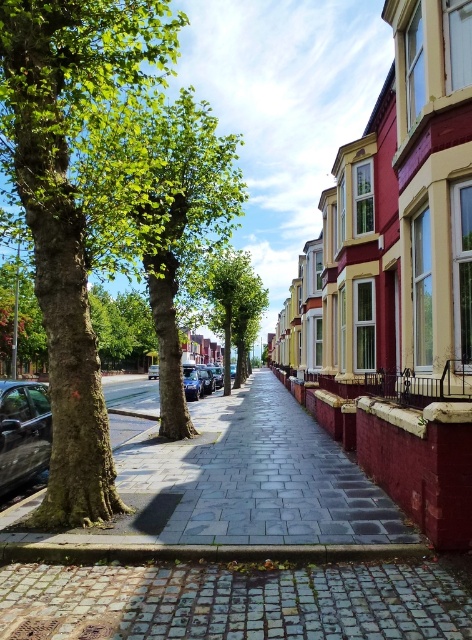
Question: Can you confirm if green rough bark tree at left is wider than shiny black car at left?

Choices:
 (A) no
 (B) yes

Answer: (B)

Question: Does shiny metallic car at center have a larger size compared to shiny blue car at center?

Choices:
 (A) no
 (B) yes

Answer: (A)

Question: Which of the following is the farthest from the observer?

Choices:
 (A) tap(108, 458)
 (B) tap(151, 374)
 (C) tap(186, 381)
 (D) tap(44, 419)

Answer: (B)

Question: Which object is farther from the camera taking this photo?

Choices:
 (A) green rough bark tree at left
 (B) green leafy tree at center
 (C) shiny metallic car at center
 (D) shiny black car at left

Answer: (C)

Question: Is green rough bark tree at left thinner than shiny metallic car at center?

Choices:
 (A) no
 (B) yes

Answer: (A)

Question: Based on their relative distances, which object is nearer to the shiny metallic car at center?

Choices:
 (A) green leafy tree at center
 (B) green rough bark tree at left
 (C) shiny black car at left
 (D) shiny blue car at center

Answer: (A)